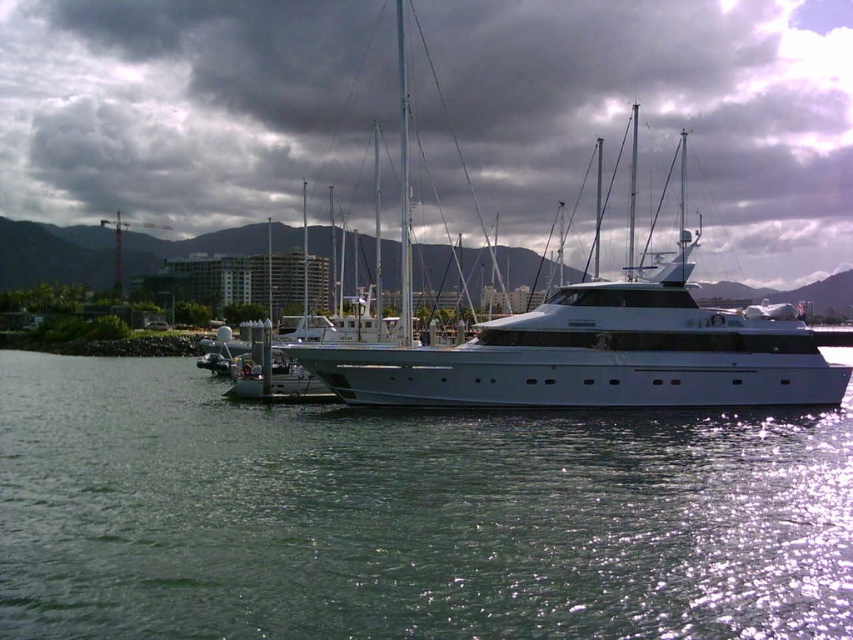
From the picture: Can you confirm if green water at lower center is thinner than white glossy yacht at center?

Yes, green water at lower center is thinner than white glossy yacht at center.

Which of these two, green water at lower center or white glossy yacht at center, stands taller?

Standing taller between the two is white glossy yacht at center.

The image size is (853, 640). Find the location of `green water at lower center`. green water at lower center is located at coordinates 405,516.

Which is behind, point (368, 484) or point (735, 236)?

Positioned behind is point (735, 236).

Which is in front, point (161, 573) or point (762, 4)?

Point (161, 573) is more forward.

The image size is (853, 640). What are the coordinates of `green water at lower center` in the screenshot? It's located at (405, 516).

Can you confirm if dark gray cloud at upper center is positioned below white glossy yacht at center?

No.

Is point (529, 92) less distant than point (483, 344)?

No, (529, 92) is further to viewer.

Locate an element on the screen. This screenshot has width=853, height=640. dark gray cloud at upper center is located at coordinates (651, 113).